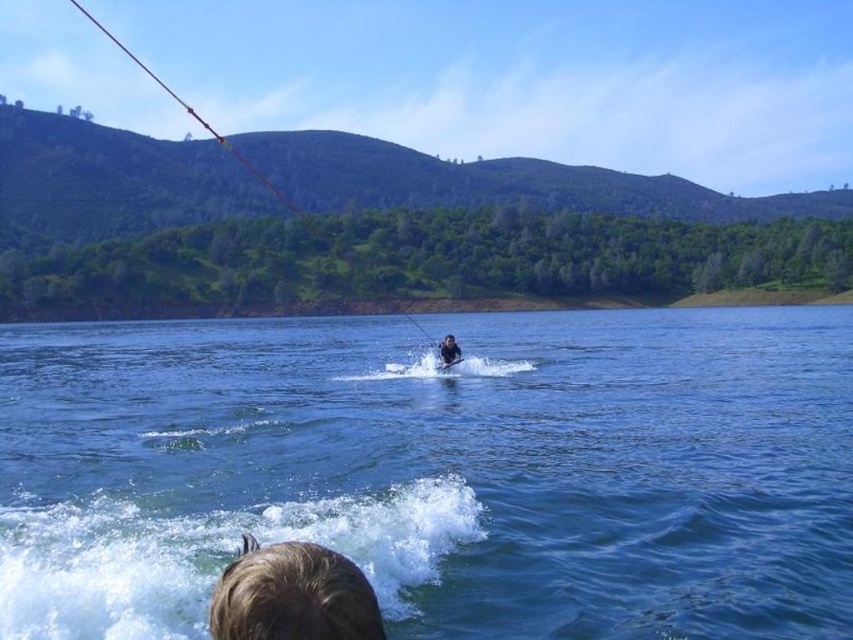
Consider the image. You are a photographer trying to capture the skier and the water spray. Based on the scene, can you tell if the brown hair at lower center is closer to the camera than the blue liquid water at center?

The brown hair at lower center is behind blue liquid water at center, so it is farther from the camera than the blue liquid water at center.

Consider the image. You are a photographer trying to capture the water spray from the skier. You have a camera with a lens that can focus on objects up to 2 meters wide. The blue liquid water at center and brown hair at lower center are in your frame. Which object will the camera focus on better?

The blue liquid water at center has a larger width than the brown hair at lower center, so the camera will focus better on the blue liquid water at center since it is wider and within the 2 meters focus range.